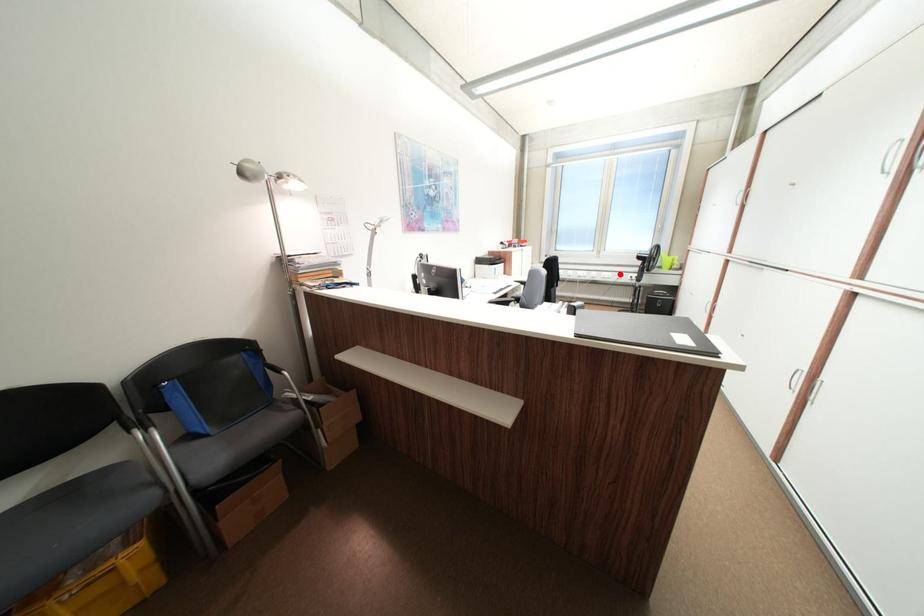
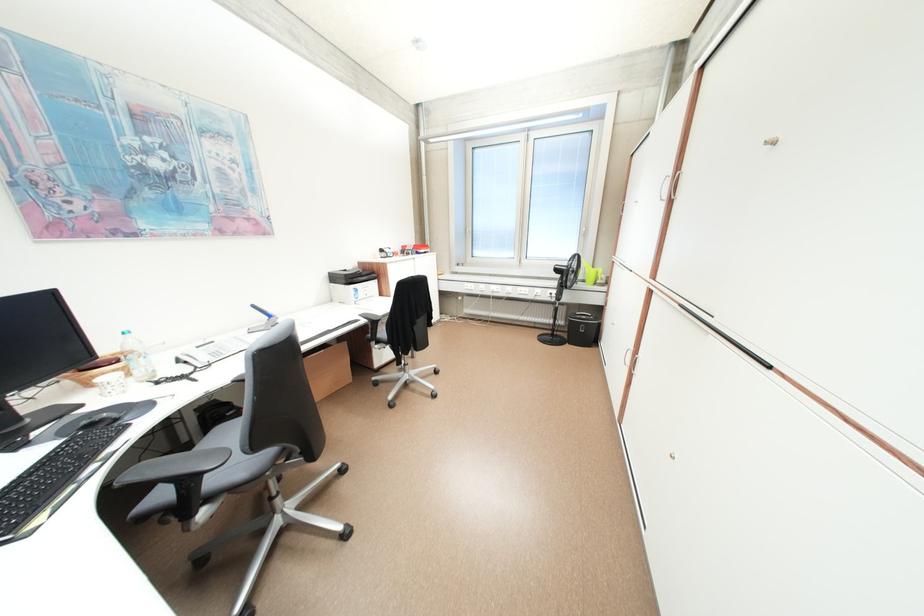
Question: I am providing you with two images of the same scene from different viewpoints. In image1, a red point is highlighted. Considering the same 3D point in image2, which of the following is correct?

Choices:
 (A) It is closer
 (B) It is farther

Answer: (B)